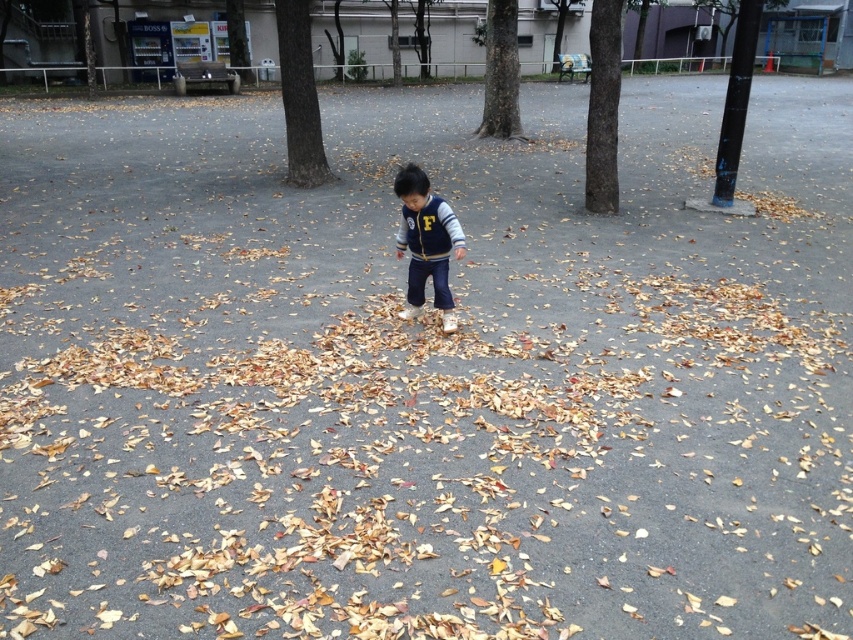
Question: Among these objects, which one is farthest from the camera?

Choices:
 (A) brown rough bark tree at center
 (B) brown rough bark tree at upper center
 (C) smooth bark tree at center
 (D) navy blue fleece jacket at center

Answer: (C)

Question: Is brown rough bark tree at upper center thinner than smooth bark tree at center?

Choices:
 (A) yes
 (B) no

Answer: (A)

Question: In this image, where is brown rough bark tree at upper center located relative to smooth bark tree at center?

Choices:
 (A) left
 (B) right

Answer: (A)

Question: In this image, where is brown rough bark tree at upper center located relative to brown rough bark tree at center?

Choices:
 (A) left
 (B) right

Answer: (A)

Question: Among these objects, which one is nearest to the camera?

Choices:
 (A) brown rough bark tree at center
 (B) brown rough bark tree at upper center
 (C) smooth bark tree at center
 (D) navy blue fleece jacket at center

Answer: (D)

Question: Estimate the real-world distances between objects in this image. Which object is farther from the smooth bark tree at center?

Choices:
 (A) brown rough bark tree at upper center
 (B) navy blue fleece jacket at center
 (C) brown rough bark tree at center

Answer: (B)